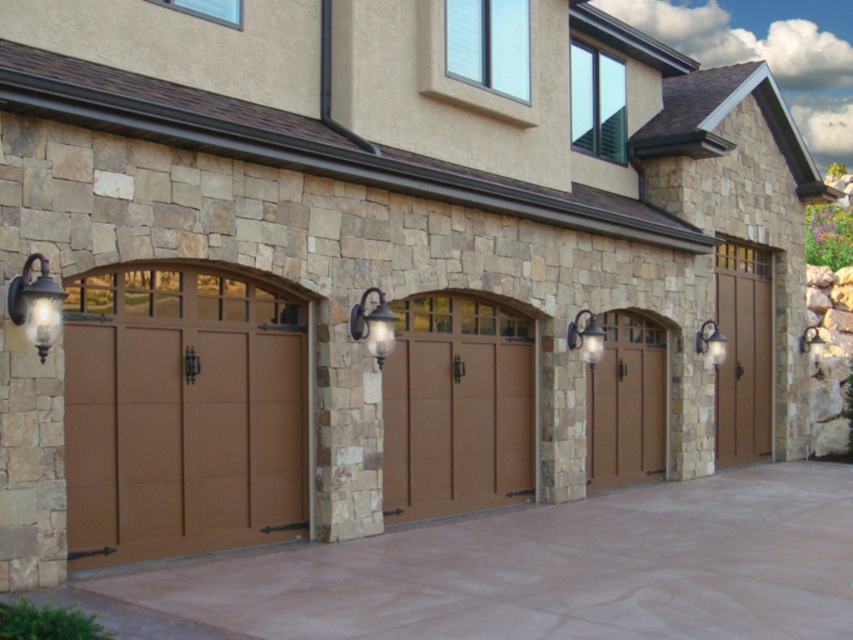
In the scene shown: You are a delivery person trying to determine the distance between the two matte black sconces. The delivery truck requires a minimum of 3 meters between objects to safely navigate. Can the truck pass between the matte black sconce at center and the matte black sconce at upper right?

The matte black sconce at center is 3.65 meters from the matte black sconce at upper right. Since the required minimum distance is 3 meters, the truck can safely navigate between them as the distance is sufficient.

You are a delivery person trying to park your van in the driveway. The van requires a space larger than the brown wood door at right. Can the brown concrete driveway at center accommodate the van?

The brown concrete driveway at center is larger in size than the brown wood door at right, so yes, the brown concrete driveway at center can accommodate the van since it is bigger than the brown wood door at right.